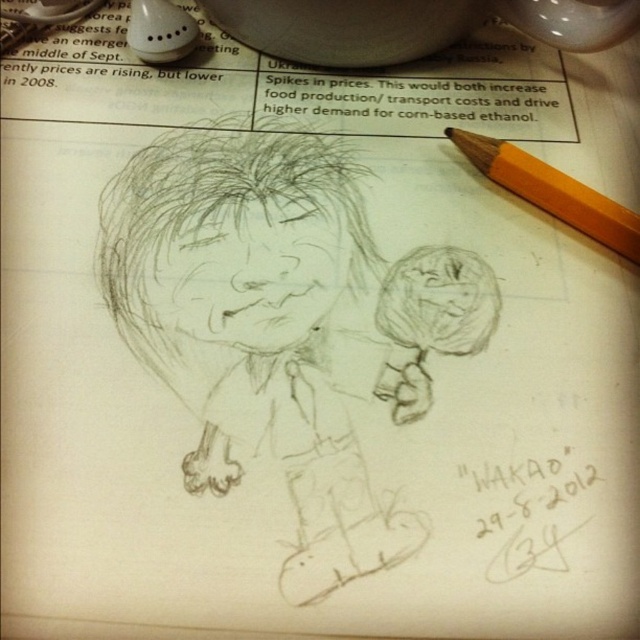
Which is behind, point (340, 352) or point (605, 241)?

Point (605, 241)

Is graphite sketch at center wider than yellow wood pencil at upper right?

Yes.

Where is `graphite sketch at center`? graphite sketch at center is located at coordinates (266, 330).